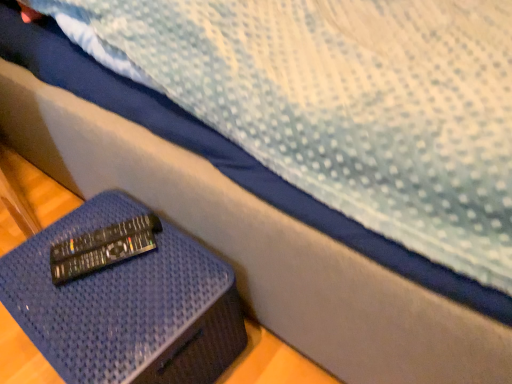
Question: Should I look upward or downward to see black plastic remote at lower left, which is the first remote from front to back?

Choices:
 (A) up
 (B) down

Answer: (B)

Question: Is blue textured ottoman at lower left far from black plastic remote at lower left, which is the first remote from front to back?

Choices:
 (A) no
 (B) yes

Answer: (A)

Question: From a real-world perspective, is blue textured ottoman at lower left on black plastic remote at lower left, the second remote viewed from the back?

Choices:
 (A) yes
 (B) no

Answer: (B)

Question: Can you confirm if blue textured ottoman at lower left is positioned to the right of black plastic remote at lower left, which is the first remote from front to back?

Choices:
 (A) yes
 (B) no

Answer: (A)

Question: Is the depth of blue textured ottoman at lower left less than that of black plastic remote at lower left, which is the first remote from front to back?

Choices:
 (A) yes
 (B) no

Answer: (A)

Question: Can you confirm if blue textured ottoman at lower left is thinner than black plastic remote at lower left, which is the first remote from front to back?

Choices:
 (A) yes
 (B) no

Answer: (B)

Question: Considering the relative sizes of blue textured ottoman at lower left and black plastic remote at lower left, the second remote viewed from the back, in the image provided, is blue textured ottoman at lower left wider than black plastic remote at lower left, the second remote viewed from the back,?

Choices:
 (A) yes
 (B) no

Answer: (A)

Question: Is black plastic remote at lower left, which is the first remote from front to back, at the left side of black plastic remote at lower left, acting as the 2th remote starting from the front?

Choices:
 (A) no
 (B) yes

Answer: (A)

Question: Does black plastic remote at lower left, the second remote viewed from the back, have a larger size compared to black plastic remote at lower left, acting as the 2th remote starting from the front?

Choices:
 (A) no
 (B) yes

Answer: (B)

Question: Are black plastic remote at lower left, the second remote viewed from the back, and black plastic remote at lower left, acting as the 2th remote starting from the front, located far from each other?

Choices:
 (A) yes
 (B) no

Answer: (B)

Question: Is black plastic remote at lower left, which is the first remote from front to back, with black plastic remote at lower left, acting as the 1th remote starting from the back?

Choices:
 (A) no
 (B) yes

Answer: (B)

Question: Is black plastic remote at lower left, the second remote viewed from the back, thinner than black plastic remote at lower left, acting as the 1th remote starting from the back?

Choices:
 (A) yes
 (B) no

Answer: (A)

Question: Does black plastic remote at lower left, the second remote viewed from the back, contain black plastic remote at lower left, acting as the 1th remote starting from the back?

Choices:
 (A) yes
 (B) no

Answer: (B)

Question: Does black plastic remote at lower left, the second remote viewed from the back, lie behind blue textured ottoman at lower left?

Choices:
 (A) no
 (B) yes

Answer: (B)